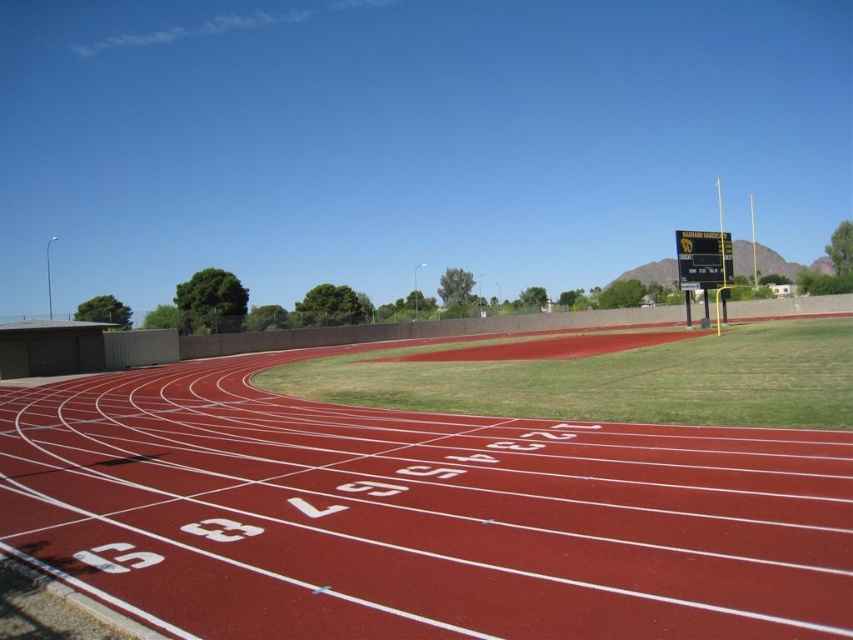
Question: Is rubberized red track at center smaller than yellow-green plastic scoreboard at upper right?

Choices:
 (A) yes
 (B) no

Answer: (B)

Question: Among these points, which one is farthest from the camera?

Choices:
 (A) (70, 540)
 (B) (677, 246)

Answer: (B)

Question: Where is rubberized red track at center located in relation to yellow-green plastic scoreboard at upper right in the image?

Choices:
 (A) above
 (B) below

Answer: (B)

Question: Which point is closer to the camera?

Choices:
 (A) [722, 241]
 (B) [218, 628]

Answer: (B)

Question: Does rubberized red track at center come behind yellow-green plastic scoreboard at upper right?

Choices:
 (A) yes
 (B) no

Answer: (B)